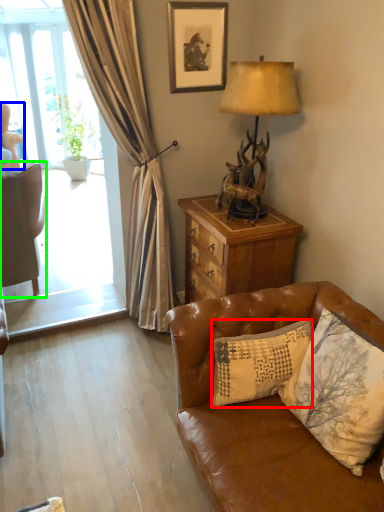
Question: Considering the real-world distances, which object is closest to pillow (highlighted by a red box)? chair (highlighted by a blue box) or chair (highlighted by a green box).

Choices:
 (A) chair
 (B) chair

Answer: (B)